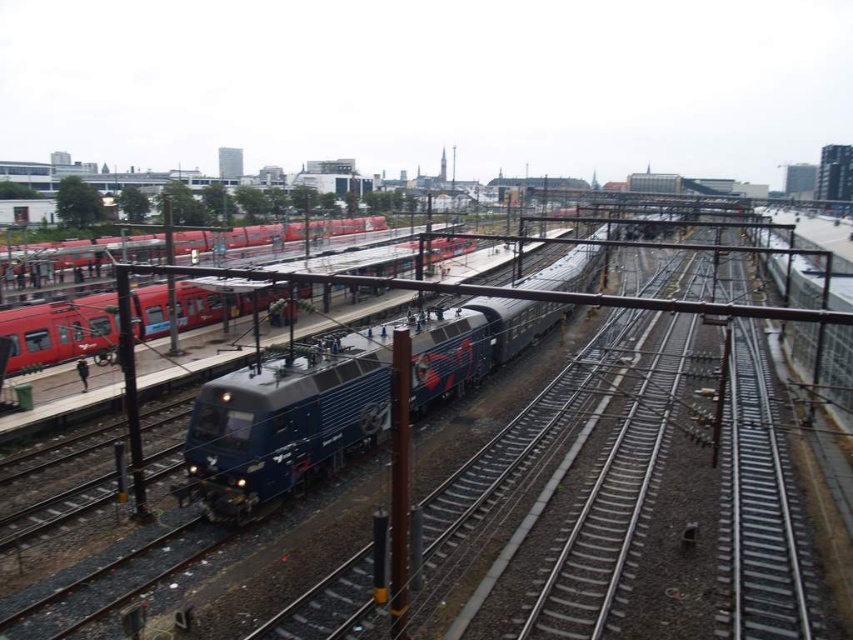
You are a passenger waiting at the station. You see the metallic blue train at center and the red matte train at left. Which train is closer to the platform where passengers are boarding?

The red matte train at left is closer to the platform where passengers are boarding because it is positioned to the left of the metallic blue train at center, which is further away.

Based on the photo, you are a passenger standing at the platform on the left side of the image. You see the point marked at coordinate (337, 400). What object is located at that point?

The point marked at coordinate (337, 400) marks the metallic blue locomotive at center.

You are a railway engineer assessing the platform layout. You notice two trains at the left platform, a matte red train at left and a red matte train at left. Which one is shorter in height?

The matte red train at left is not as tall as the red matte train at left, so the matte red train at left is shorter in height.